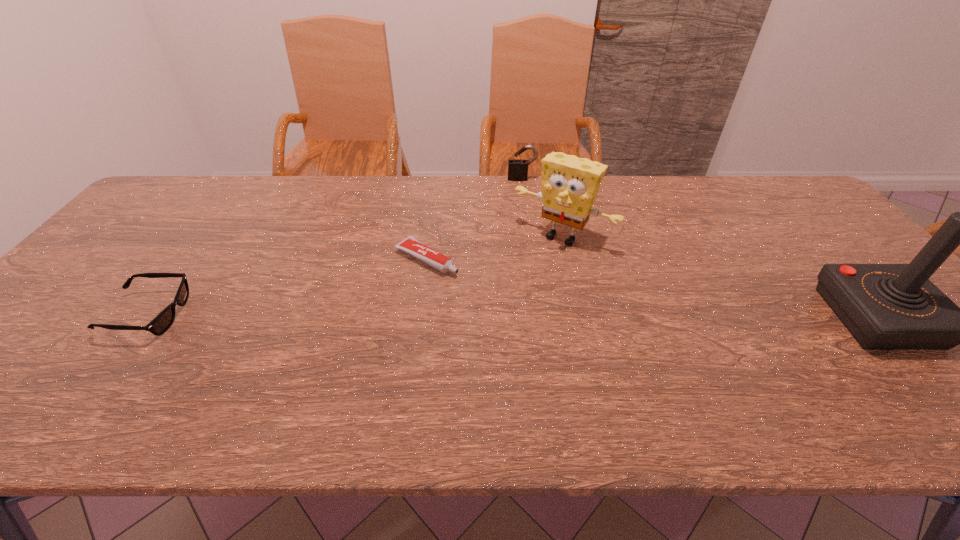
Identify the location of object at the far edge. (517, 169).

I want to click on object that is positioned at the near edge, so click(884, 306).

Locate an element on the screen. This screenshot has height=540, width=960. object that is at the right edge is located at coordinates (884, 306).

You are a GUI agent. You are given a task and a screenshot of the screen. Output one action in this format:
    pyautogui.click(x=<x>, y=<y>)
    Task: Click on the object present at the near right corner
    The width and height of the screenshot is (960, 540).
    Given the screenshot: What is the action you would take?
    pyautogui.click(x=884, y=306)

The width and height of the screenshot is (960, 540). What are the coordinates of `free space at the far edge` in the screenshot? It's located at (354, 205).

Locate an element on the screen. The width and height of the screenshot is (960, 540). free space at the near edge of the desktop is located at coordinates (114, 379).

Locate an element on the screen. vacant space at the right edge is located at coordinates (846, 241).

Where is `vacant space at the far left corner of the desktop`? vacant space at the far left corner of the desktop is located at coordinates (196, 201).

You are a GUI agent. You are given a task and a screenshot of the screen. Output one action in this format:
    pyautogui.click(x=<x>, y=<y>)
    Task: Click on the vacant region at the far right corner
    The width and height of the screenshot is (960, 540).
    Given the screenshot: What is the action you would take?
    pyautogui.click(x=783, y=178)

Identify the location of vacant space at the near right corner. (903, 362).